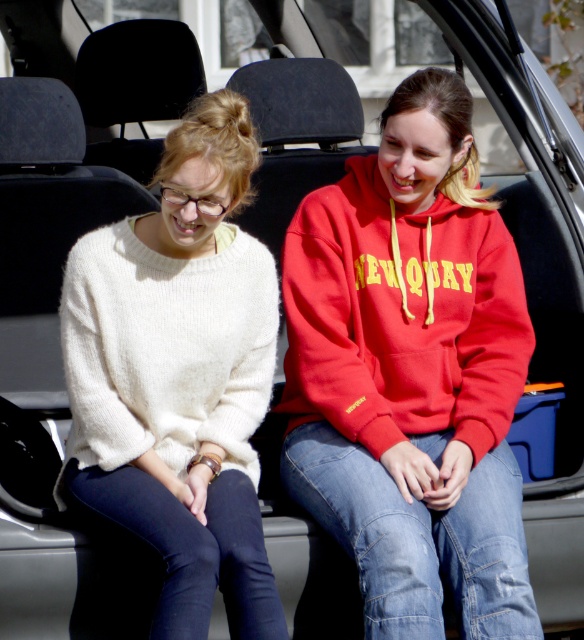
Question: Is the position of matte red hoodie at center less distant than that of white fuzzy sweater at left?

Choices:
 (A) no
 (B) yes

Answer: (A)

Question: Is matte red hoodie at center positioned in front of white fuzzy sweater at left?

Choices:
 (A) yes
 (B) no

Answer: (B)

Question: Among these objects, which one is farthest from the camera?

Choices:
 (A) white fuzzy sweater at left
 (B) matte red hoodie at center

Answer: (B)

Question: Which point is farther to the camera?

Choices:
 (A) matte red hoodie at center
 (B) white fuzzy sweater at left

Answer: (A)

Question: Considering the relative positions of matte red hoodie at center and white fuzzy sweater at left in the image provided, where is matte red hoodie at center located with respect to white fuzzy sweater at left?

Choices:
 (A) right
 (B) left

Answer: (A)

Question: Among these points, which one is nearest to the camera?

Choices:
 (A) (496, 412)
 (B) (171, 237)

Answer: (B)